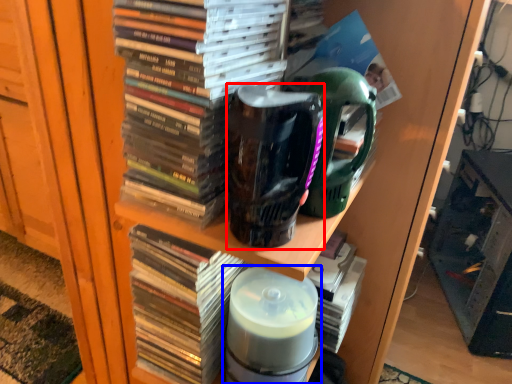
Question: Which of the following is the closest to the observer, mug (highlighted by a red box) or bottle (highlighted by a blue box)?

Choices:
 (A) mug
 (B) bottle

Answer: (A)